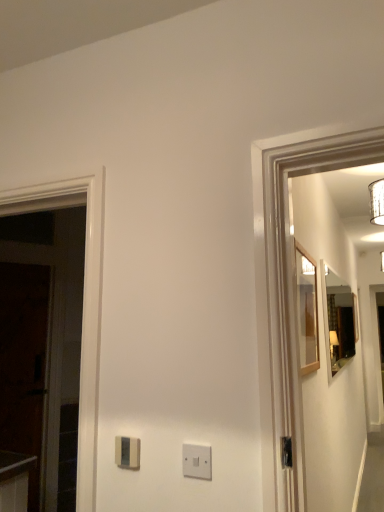
Question: Considering the positions of white plastic light switch at center, marked as the first light switch in a front-to-back arrangement, and satin beige light switch at center, the second light switch when ordered from front to back, in the image, is white plastic light switch at center, marked as the first light switch in a front-to-back arrangement, taller or shorter than satin beige light switch at center, the second light switch when ordered from front to back,?

Choices:
 (A) short
 (B) tall

Answer: (B)

Question: Would you say white plastic light switch at center, which is the 1th light switch from right to left, is to the left or to the right of satin beige light switch at center, the second light switch when ordered from front to back, in the picture?

Choices:
 (A) left
 (B) right

Answer: (B)

Question: Which object is the farthest from the dark wood door at left?

Choices:
 (A) satin beige light switch at center, which is counted as the second light switch, starting from the right
 (B) matte wooden mirror at right, which is the first mirror in right-to-left order
 (C) white plastic light switch at center, the second light switch in the left-to-right sequence
 (D) wooden-framed mirror at right, the 2th mirror from the right

Answer: (B)

Question: Which is farther from the satin beige light switch at center, marked as the 1th light switch in a back-to-front arrangement?

Choices:
 (A) wooden-framed mirror at right, the first mirror in the front-to-back sequence
 (B) white plastic light switch at center, which is the 1th light switch from right to left
 (C) dark wood door at left
 (D) matte wooden mirror at right, which is the first mirror in right-to-left order

Answer: (D)